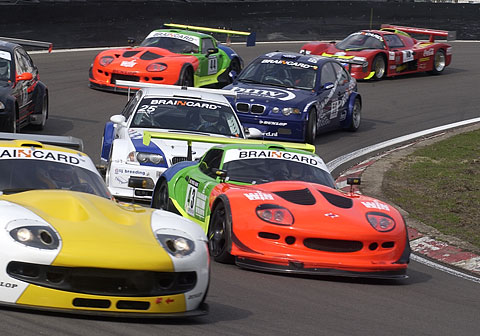
This screenshot has width=480, height=336. Identify the location of hoods. (122, 226), (169, 149), (312, 213), (151, 54), (276, 97), (355, 56).